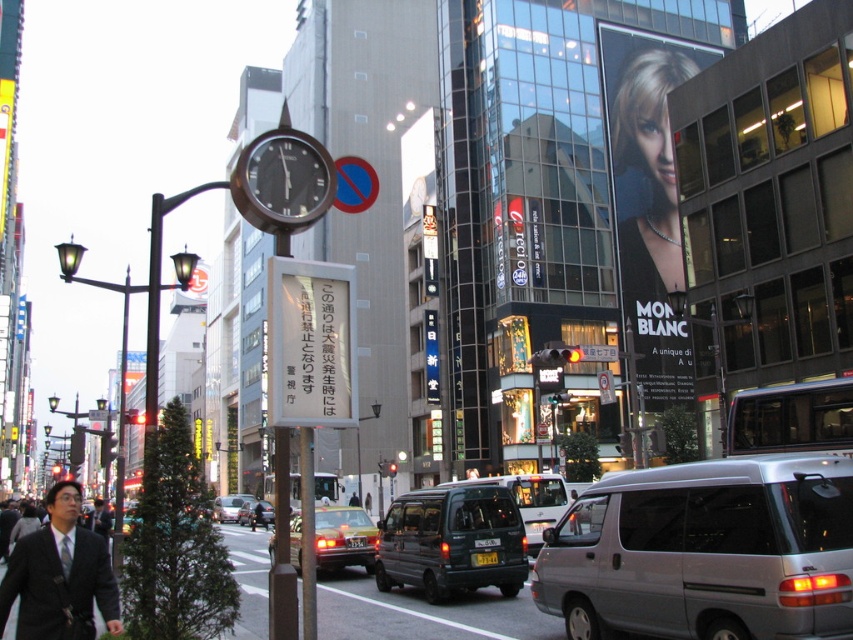
Question: Which object appears closest to the camera in this image?

Choices:
 (A) metallic silver van at center
 (B) white paper sign at center

Answer: (B)

Question: Which object is the closest to the silver metallic van at lower right?

Choices:
 (A) metallic green van at center
 (B) shiny silver necklace at upper right
 (C) black polished clock at center

Answer: (A)

Question: Which point is farther to the camera?

Choices:
 (A) (267, 358)
 (B) (250, 513)
 (C) (228, 522)

Answer: (C)

Question: Can you confirm if yellow metallic taxi at center is thinner than metallic silver sedan at center?

Choices:
 (A) yes
 (B) no

Answer: (A)

Question: Does white paper sign at center come in front of dark gray suit at lower left?

Choices:
 (A) yes
 (B) no

Answer: (B)

Question: Can you confirm if metallic green van at center is thinner than metallic silver sedan at center?

Choices:
 (A) yes
 (B) no

Answer: (A)